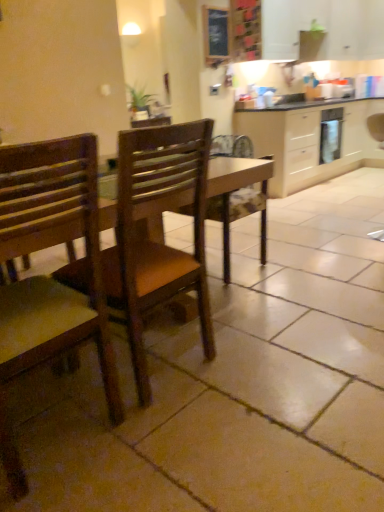
Where is `vacant area in front of wooden chair at center, which is the 1th chair in right-to-left order`? The image size is (384, 512). vacant area in front of wooden chair at center, which is the 1th chair in right-to-left order is located at coordinates (176, 444).